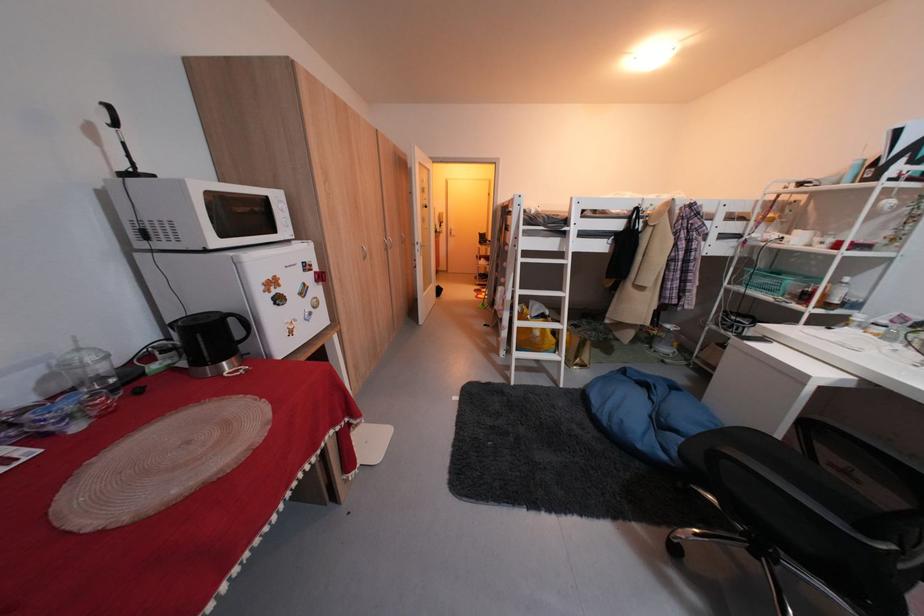
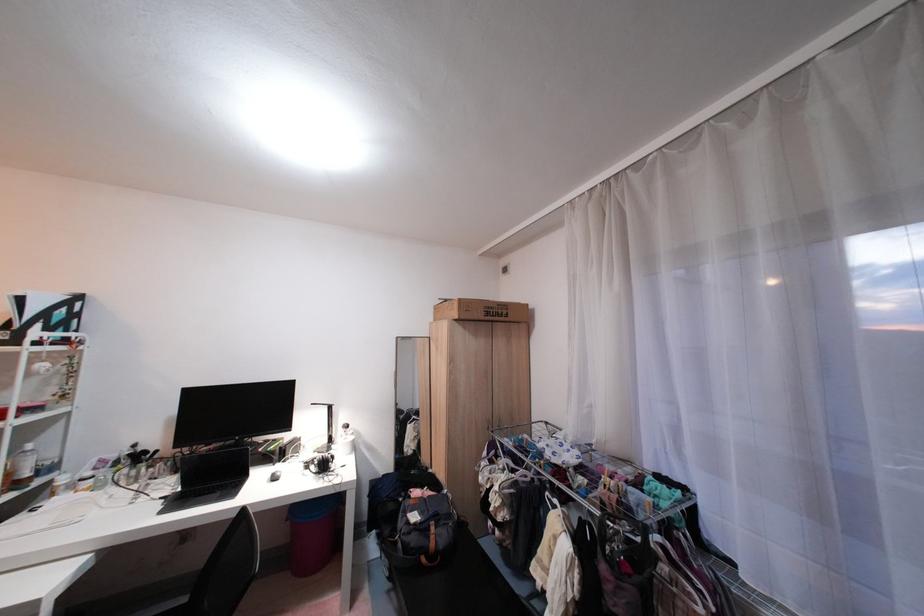
Where in the second image is the point corresponding to pixel 853 284 from the first image?

(35, 453)